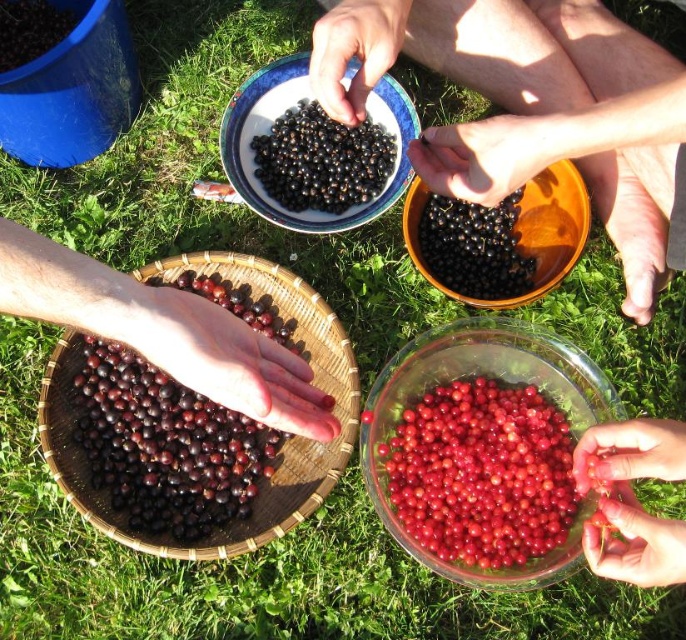
Identify the location of black matte berries at center. (320, 161).

What do you see at coordinates (320, 161) in the screenshot? I see `black matte berries at center` at bounding box center [320, 161].

Is point (289, 131) in front of point (410, 204)?

That is False.

Locate an element on the screen. black matte berries at center is located at coordinates (320, 161).

Who is shorter, dark brown woven basket at lower left or orange ceramic bowl at center?

With less height is orange ceramic bowl at center.

Does point (130, 320) come behind point (569, 168)?

No, it is not.

Describe the element at coordinates (163, 332) in the screenshot. The image size is (686, 640). I see `dark brown woven basket at lower left` at that location.

Find the location of a particular element. dark brown woven basket at lower left is located at coordinates (163, 332).

Between dark brown woven basket at lower left and matte ceramic bowl at center, which one appears on the right side from the viewer's perspective?

matte ceramic bowl at center

Does dark brown woven basket at lower left appear on the left side of matte ceramic bowl at center?

Indeed, dark brown woven basket at lower left is positioned on the left side of matte ceramic bowl at center.

Which is behind, point (226, 355) or point (377, 99)?

The point (377, 99) is behind.

Locate an element on the screen. The image size is (686, 640). dark brown woven basket at lower left is located at coordinates (163, 332).